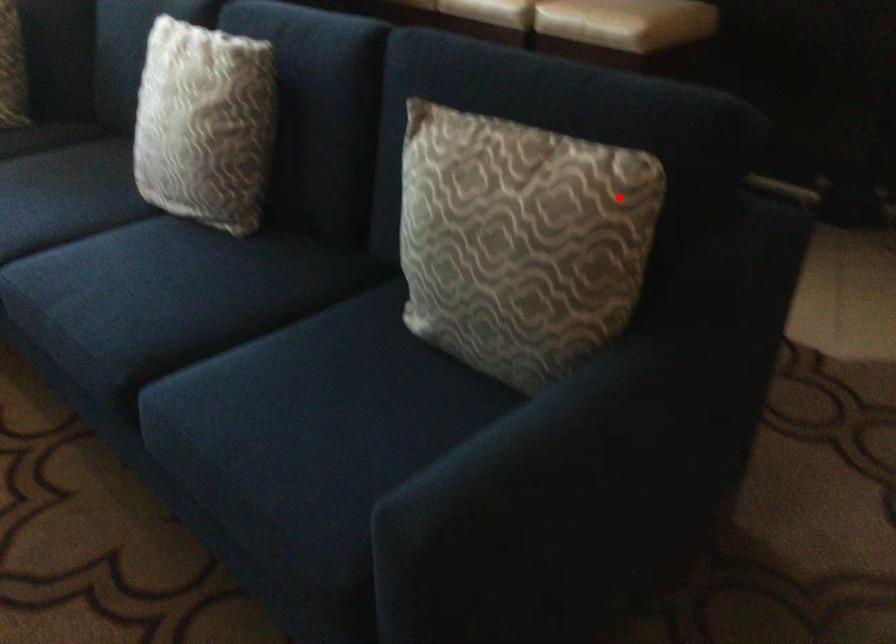
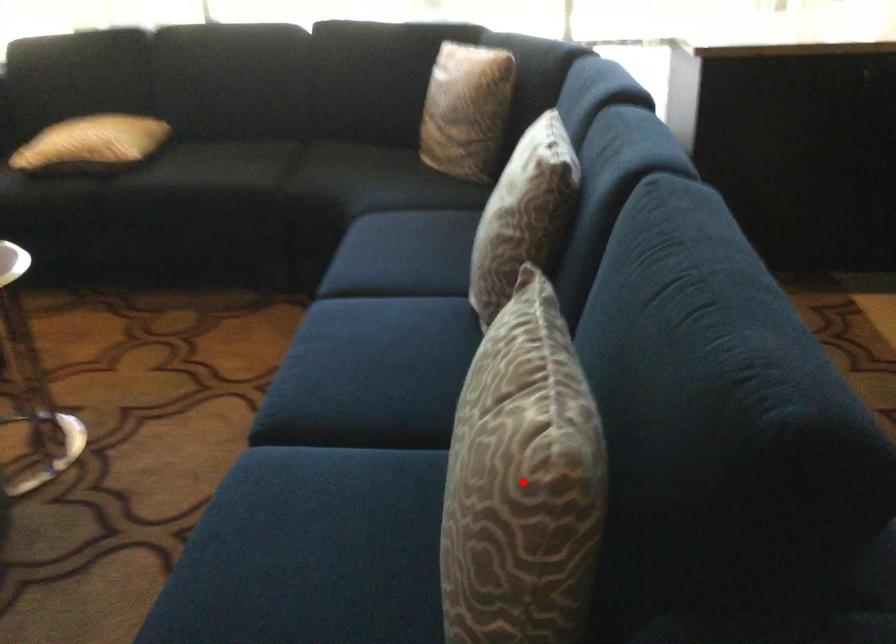
I am providing you with two images of the same scene from different viewpoints. A red point is marked on the first image and another point is marked on the second image. Do the highlighted points in image1 and image2 indicate the same real-world spot?

Yes